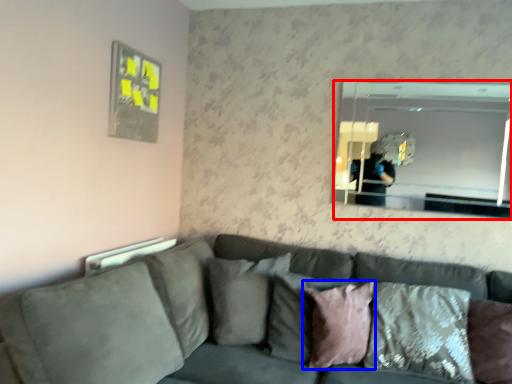
Question: Among these objects, which one is farthest to the camera, mirror (highlighted by a red box) or pillow (highlighted by a blue box)?

Choices:
 (A) mirror
 (B) pillow

Answer: (A)